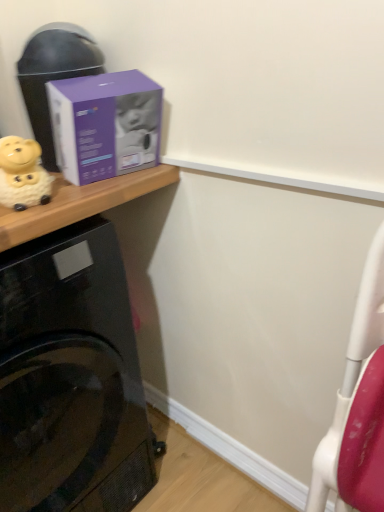
Question: Is yellow matte piggy bank at left next to purple matte box at upper left and touching it?

Choices:
 (A) no
 (B) yes

Answer: (A)

Question: Can you confirm if yellow matte piggy bank at left is shorter than purple matte box at upper left?

Choices:
 (A) yes
 (B) no

Answer: (A)

Question: Would you say yellow matte piggy bank at left is outside purple matte box at upper left?

Choices:
 (A) no
 (B) yes

Answer: (B)

Question: Could you tell me if yellow matte piggy bank at left is turned towards purple matte box at upper left?

Choices:
 (A) no
 (B) yes

Answer: (A)

Question: Is purple matte box at upper left at the back of yellow matte piggy bank at left?

Choices:
 (A) yes
 (B) no

Answer: (B)

Question: Does yellow matte piggy bank at left come in front of purple matte box at upper left?

Choices:
 (A) no
 (B) yes

Answer: (B)

Question: Is purple cardboard box at upper left at the right side of yellow matte piggy bank at left?

Choices:
 (A) yes
 (B) no

Answer: (A)

Question: Does purple cardboard box at upper left have a smaller size compared to yellow matte piggy bank at left?

Choices:
 (A) no
 (B) yes

Answer: (A)

Question: Is purple cardboard box at upper left facing away from yellow matte piggy bank at left?

Choices:
 (A) yes
 (B) no

Answer: (B)

Question: Can you confirm if purple cardboard box at upper left is bigger than yellow matte piggy bank at left?

Choices:
 (A) no
 (B) yes

Answer: (B)

Question: From the image's perspective, is purple cardboard box at upper left above yellow matte piggy bank at left?

Choices:
 (A) no
 (B) yes

Answer: (B)

Question: Is purple cardboard box at upper left outside of yellow matte piggy bank at left?

Choices:
 (A) yes
 (B) no

Answer: (A)

Question: Is the depth of black glossy washing machine at lower left greater than that of yellow matte piggy bank at left?

Choices:
 (A) yes
 (B) no

Answer: (B)